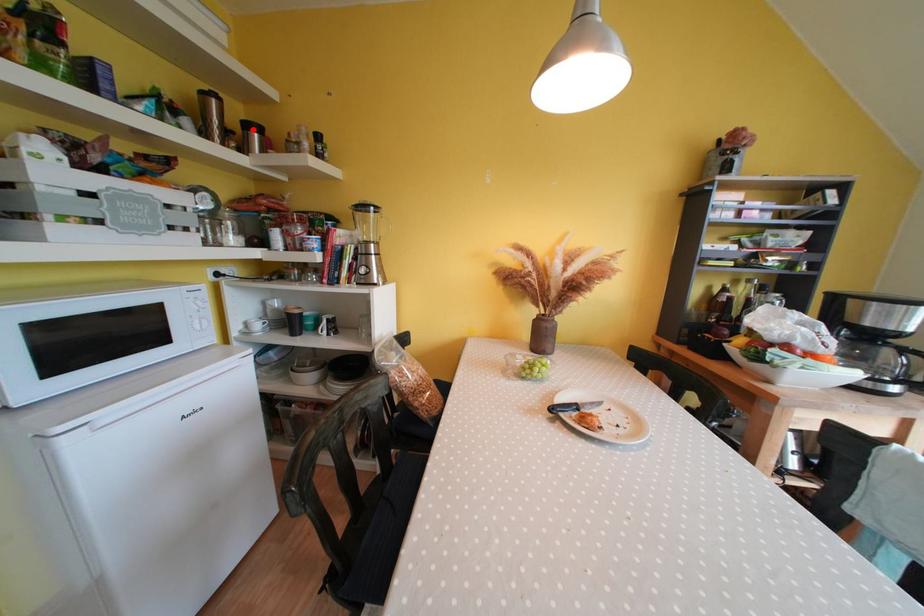
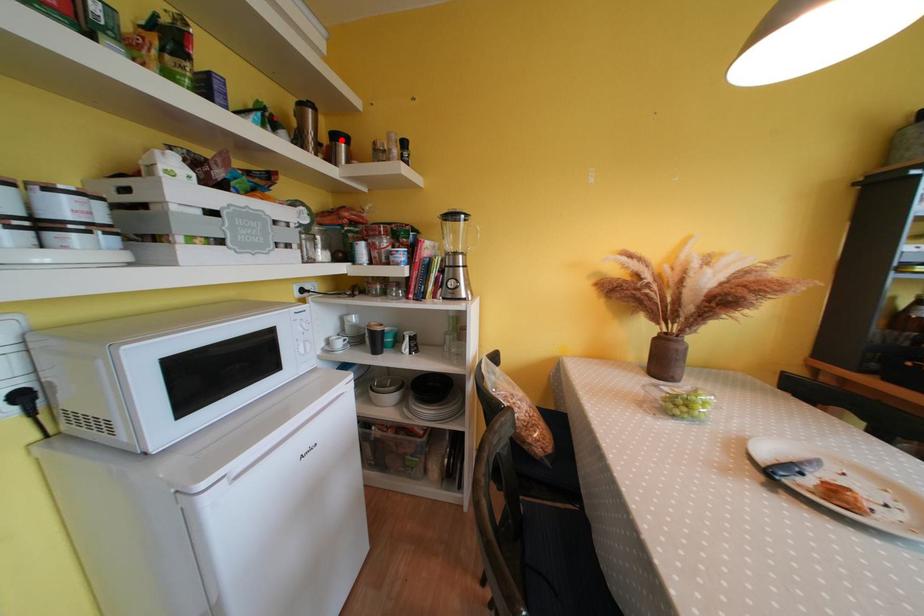
I am providing you with two images of the same scene from different viewpoints. A red point is marked on the first image and another point is marked on the second image. Is the red point in image1 aligned with the point shown in image2?

Yes